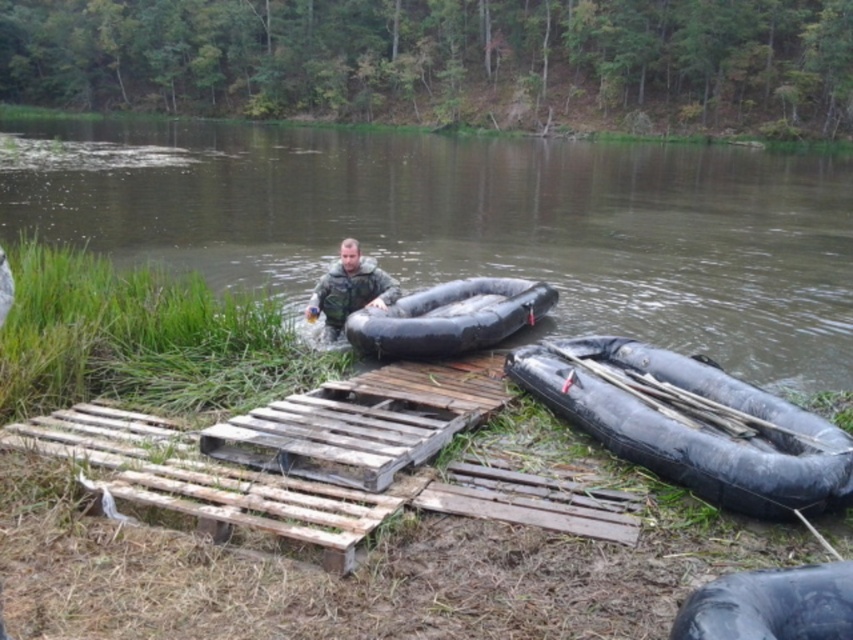
You are standing on the wooden dock and need to retrieve the camouflage fabric man at center from the black rubber canoe at right. Is the canoe directly beneath the man, making it easy to reach him?

The black rubber canoe at right is positioned under camouflage fabric man at center, so yes, the canoe is directly beneath the man, making it easy to reach him.

You are standing on the wooden dock and want to retrieve the black rubber tire at lower right. However, there is a black rubber canoe at center in your path. Can you reach the tire without moving the canoe?

The black rubber canoe at center is above the black rubber tire at lower right, so the canoe is blocking the direct path to the tire. You would need to move the canoe to access the tire.